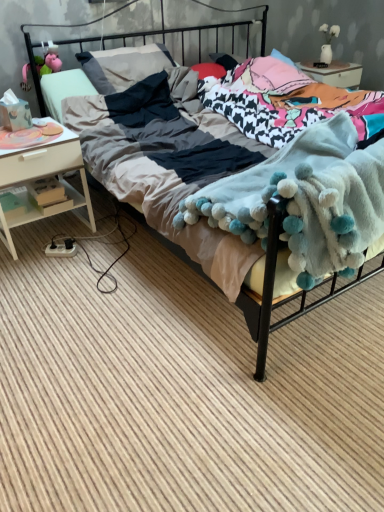
Question: From the image's perspective, is white wood nightstand at left above wooden boxes at left?

Choices:
 (A) no
 (B) yes

Answer: (B)

Question: Is white wood nightstand at left in contact with wooden boxes at left?

Choices:
 (A) yes
 (B) no

Answer: (A)

Question: Is white wood nightstand at left located outside wooden boxes at left?

Choices:
 (A) no
 (B) yes

Answer: (B)

Question: Is white wood nightstand at left positioned behind wooden boxes at left?

Choices:
 (A) no
 (B) yes

Answer: (A)

Question: Considering the relative sizes of white wood nightstand at left and wooden boxes at left in the image provided, is white wood nightstand at left shorter than wooden boxes at left?

Choices:
 (A) no
 (B) yes

Answer: (A)

Question: Is white wood nightstand at left facing towards wooden boxes at left?

Choices:
 (A) no
 (B) yes

Answer: (B)

Question: Is white wood nightstand at left next to soft cotton bed at center?

Choices:
 (A) no
 (B) yes

Answer: (A)

Question: Is white wood nightstand at left positioned far away from soft cotton bed at center?

Choices:
 (A) no
 (B) yes

Answer: (A)

Question: From the image's perspective, is white wood nightstand at left on soft cotton bed at center?

Choices:
 (A) no
 (B) yes

Answer: (A)

Question: Does white wood nightstand at left lie behind soft cotton bed at center?

Choices:
 (A) yes
 (B) no

Answer: (A)

Question: Considering the relative positions of white wood nightstand at left and soft cotton bed at center in the image provided, is white wood nightstand at left to the left of soft cotton bed at center from the viewer's perspective?

Choices:
 (A) no
 (B) yes

Answer: (B)

Question: Does white wood nightstand at left have a greater width compared to soft cotton bed at center?

Choices:
 (A) yes
 (B) no

Answer: (B)

Question: Is there a large distance between soft cotton bed at center and fluffy white blanket at center?

Choices:
 (A) no
 (B) yes

Answer: (B)